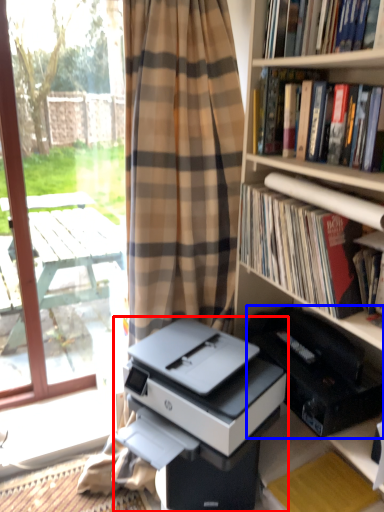
Question: Among these objects, which one is farthest to the camera, printer (highlighted by a red box) or printer (highlighted by a blue box)?

Choices:
 (A) printer
 (B) printer

Answer: (B)